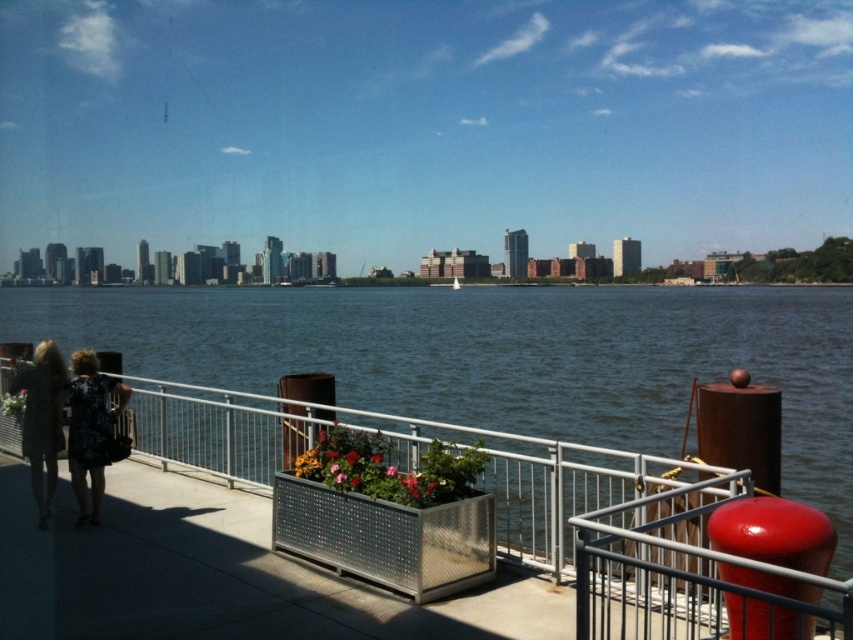
Question: Can you confirm if metallic water at center is smaller than black floral dress at lower left?

Choices:
 (A) no
 (B) yes

Answer: (A)

Question: Which point is closer to the camera taking this photo?

Choices:
 (A) (97, 424)
 (B) (650, 426)

Answer: (A)

Question: Can you confirm if black floral dress at lower left is thinner than printed fabric dress at lower left?

Choices:
 (A) yes
 (B) no

Answer: (B)

Question: Which object appears closest to the camera in this image?

Choices:
 (A) printed fabric dress at lower left
 (B) metallic water at center

Answer: (A)

Question: Which object is closer to the camera taking this photo?

Choices:
 (A) black floral dress at lower left
 (B) printed fabric dress at lower left
 (C) metallic water at center

Answer: (A)

Question: Does metallic water at center have a greater width compared to black floral dress at lower left?

Choices:
 (A) yes
 (B) no

Answer: (A)